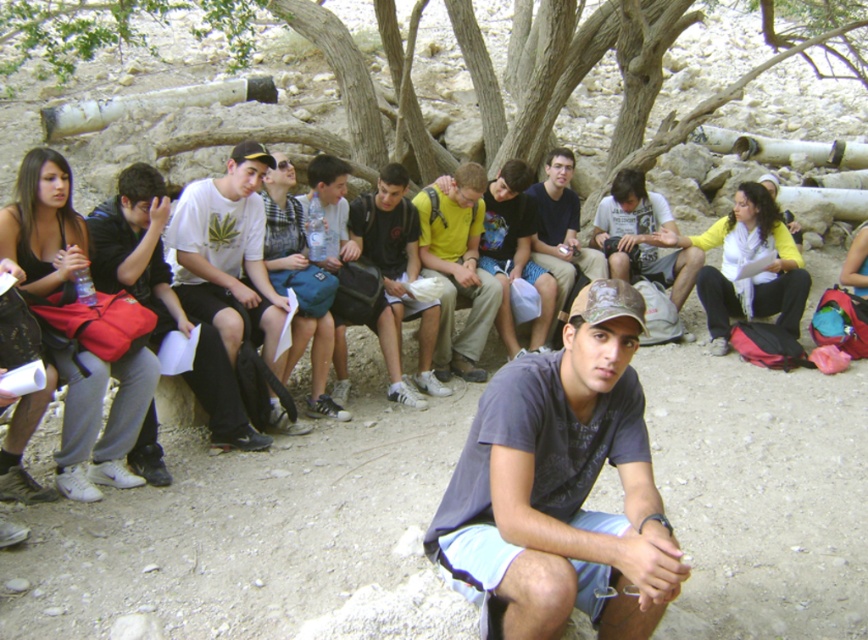
You are standing at the base of the large tree in the image and want to walk towards the point labeled as point (602, 332). Will you pass by point (576, 237) before reaching your destination?

Yes, because point (602, 332) is in front of point (576, 237). This means that when moving towards point (602, 332), you would first encounter point (576, 237) along the path.